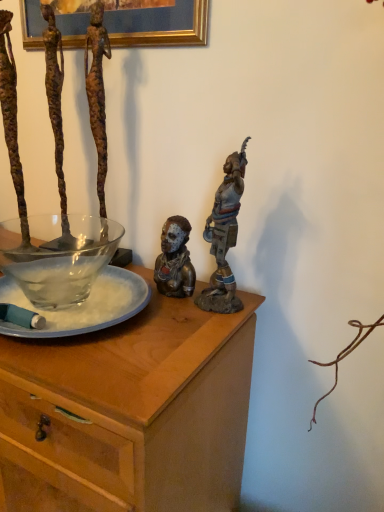
Identify the location of free space above clear glass plate at center (from a real-world perspective). (56, 281).